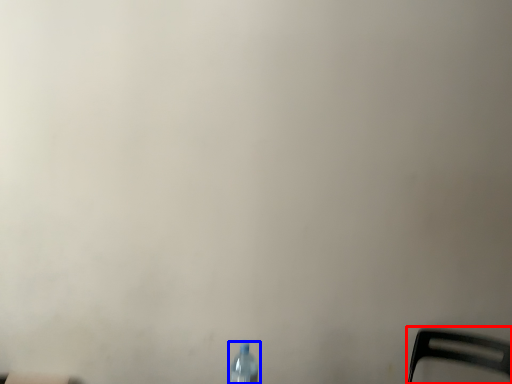
Question: Among these objects, which one is nearest to the camera, chair (highlighted by a red box) or bottle (highlighted by a blue box)?

Choices:
 (A) chair
 (B) bottle

Answer: (B)